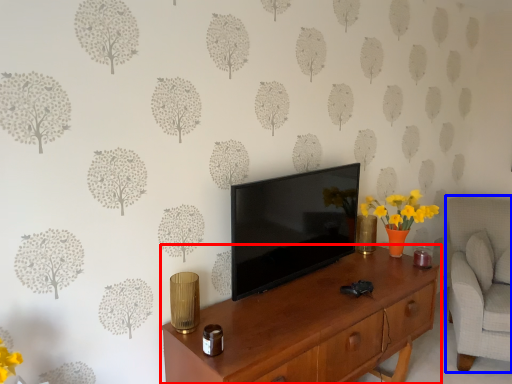
Question: Which object appears farthest to the camera in this image, desk (highlighted by a red box) or swivel chair (highlighted by a blue box)?

Choices:
 (A) desk
 (B) swivel chair

Answer: (B)